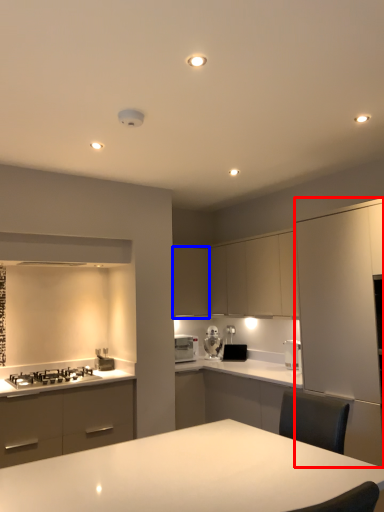
Question: Which point is further to the camera, cabinetry (highlighted by a red box) or cabinetry (highlighted by a blue box)?

Choices:
 (A) cabinetry
 (B) cabinetry

Answer: (B)